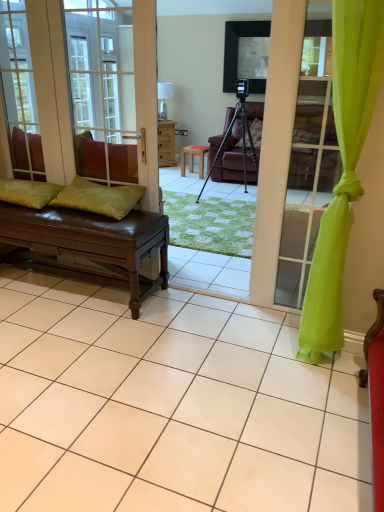
Where is `green fabric pillow at left, which is the 1th pillow in left-to-right order`? This screenshot has height=512, width=384. green fabric pillow at left, which is the 1th pillow in left-to-right order is located at coordinates (28, 192).

The image size is (384, 512). Describe the element at coordinates (193, 157) in the screenshot. I see `wooden stool at center` at that location.

You are a GUI agent. You are given a task and a screenshot of the screen. Output one action in this format:
    pyautogui.click(x=<x>, y=<y>)
    Task: Click on the lime green fabric at right
    This screenshot has width=384, height=512.
    Given the screenshot: What is the action you would take?
    pyautogui.click(x=343, y=168)

Describe the element at coordinates (19, 93) in the screenshot. This screenshot has height=512, width=384. I see `clear glass window at left` at that location.

You are a GUI agent. You are given a task and a screenshot of the screen. Output one action in this format:
    pyautogui.click(x=<x>, y=<y>)
    Task: Click on the brown leather bench at left
    
    Given the screenshot: What is the action you would take?
    pyautogui.click(x=86, y=226)

Which of these two, brown leather bench at left or brown leather bench at left, is bigger?

brown leather bench at left.

From the image's perspective, does brown leather bench at left appear higher than brown leather bench at left?

Yes, from the image's perspective, brown leather bench at left is on top of brown leather bench at left.

How many degrees apart are the facing directions of brown leather bench at left and brown leather bench at left?

brown leather bench at left and brown leather bench at left are facing 0.275 degrees away from each other.

From a real-world perspective, which is physically above, brown leather bench at left or brown leather bench at left?

brown leather bench at left.

Is clear glass window at left spatially inside brown leather bench at left, or outside of it?

clear glass window at left cannot be found inside brown leather bench at left.

How different are the orientations of clear glass window at left and brown leather bench at left in degrees?

0.0524 degrees separate the facing orientations of clear glass window at left and brown leather bench at left.

Based on the photo, is clear glass window at left looking in the opposite direction of brown leather bench at left?

That's not correct — clear glass window at left is not looking away from brown leather bench at left.

Which of these two, clear glass window at left or brown leather bench at left, is bigger?

Bigger between the two is brown leather bench at left.

Is point (113, 129) less distant than point (22, 199)?

No, it is not.

You are a GUI agent. You are given a task and a screenshot of the screen. Output one action in this format:
    pyautogui.click(x=<x>, y=<y>)
    Task: Click on the 2nd pillow to the left of the brown leather bench at left, counting from the anchor's position
    The width and height of the screenshot is (384, 512).
    Given the screenshot: What is the action you would take?
    pyautogui.click(x=28, y=192)

Are brown leather bench at left and green fabric pillow at left, which is the 1th pillow in left-to-right order, far apart?

brown leather bench at left is near green fabric pillow at left, which is the 1th pillow in left-to-right order, not far away.

Is brown leather bench at left behind green fabric pillow at left, which is the 1th pillow in left-to-right order?

No, brown leather bench at left is closer to the camera.

Is brown leather bench at left bigger than lime green fabric at right?

Yes.

The image size is (384, 512). I want to click on curtain to the right of brown leather bench at left, so click(x=343, y=168).

Consider the image. Is brown leather bench at left located outside lime green fabric at right?

Yes, brown leather bench at left is outside of lime green fabric at right.

Does point (156, 242) come behind point (324, 254)?

Yes, it is.

Find the location of `the 1st pillow in front of the matte black tripod at center, starting your count from the anchor`. the 1st pillow in front of the matte black tripod at center, starting your count from the anchor is located at coordinates (28, 192).

From a real-world perspective, is matte black tripod at center located higher than green fabric pillow at left, the second pillow in the right-to-left sequence?

No, from a real-world perspective, matte black tripod at center is not on top of green fabric pillow at left, the second pillow in the right-to-left sequence.

From the image's perspective, is matte black tripod at center beneath green fabric pillow at left, the second pillow in the right-to-left sequence?

Incorrect, from the image's perspective, matte black tripod at center is higher than green fabric pillow at left, the second pillow in the right-to-left sequence.

Is matte black tripod at center oriented towards green fabric pillow at left, which is the 1th pillow in left-to-right order?

Yes, matte black tripod at center is turned towards green fabric pillow at left, which is the 1th pillow in left-to-right order.

Does green leather pillow at left, which is counted as the 1th pillow, starting from the right, have a lesser width compared to lime green fabric at right?

Incorrect, the width of green leather pillow at left, which is counted as the 1th pillow, starting from the right, is not less than that of lime green fabric at right.

From the image's perspective, is green leather pillow at left, placed as the 2th pillow when sorted from left to right, above or below lime green fabric at right?

From the image's perspective, green leather pillow at left, placed as the 2th pillow when sorted from left to right, appears below lime green fabric at right.

Between green leather pillow at left, placed as the 2th pillow when sorted from left to right, and lime green fabric at right, which one has smaller size?

green leather pillow at left, placed as the 2th pillow when sorted from left to right, is smaller.

Is lime green fabric at right at the back of green leather pillow at left, which is counted as the 1th pillow, starting from the right?

No, green leather pillow at left, which is counted as the 1th pillow, starting from the right, is not facing the opposite direction of lime green fabric at right.

Is lime green fabric at right oriented away from brown leather bench at left?

No, lime green fabric at right's orientation is not away from brown leather bench at left.

Is point (369, 103) farther from camera compared to point (114, 170)?

No.

Can you confirm if lime green fabric at right is wider than brown leather bench at left?

Yes, lime green fabric at right is wider than brown leather bench at left.

Where is `screen door on the right of the brown leather bench at left`? screen door on the right of the brown leather bench at left is located at coordinates (103, 90).

There is a brown leather bench at left. Where is `window above it (from a real-world perspective)`? window above it (from a real-world perspective) is located at coordinates (19, 93).

Based on their spatial positions, is green fabric pillow at left, the second pillow in the right-to-left sequence, or lime green fabric at right further from wooden stool at center?

lime green fabric at right is positioned further to the anchor wooden stool at center.

From the image, which object appears to be nearer to green leather pillow at left, placed as the 2th pillow when sorted from left to right, green fabric pillow at left, which is the 1th pillow in left-to-right order, or brown leather bench at left?

The object closer to green leather pillow at left, placed as the 2th pillow when sorted from left to right, is brown leather bench at left.

Considering their positions, is green leather pillow at left, placed as the 2th pillow when sorted from left to right, positioned closer to lime green fabric at right than brown leather bench at left?

green leather pillow at left, placed as the 2th pillow when sorted from left to right.

Based on their spatial positions, is brown leather bench at left or lime green fabric at right closer to clear glass window at left?

The object closer to clear glass window at left is brown leather bench at left.

When comparing their distances from green fabric pillow at left, the second pillow in the right-to-left sequence, does brown leather bench at left or brown leather bench at left seem closer?

The object closer to green fabric pillow at left, the second pillow in the right-to-left sequence, is brown leather bench at left.

Based on their spatial positions, is green fabric pillow at left, the second pillow in the right-to-left sequence, or brown leather bench at left further from clear glass window at left?

brown leather bench at left is positioned further to the anchor clear glass window at left.

Estimate the real-world distances between objects in this image. Which object is closer to wooden stool at center, green leather pillow at left, which is counted as the 1th pillow, starting from the right, or clear glass window at left?

clear glass window at left is positioned closer to the anchor wooden stool at center.

Based on their spatial positions, is lime green fabric at right or brown leather bench at left further from clear glass window at left?

lime green fabric at right is positioned further to the anchor clear glass window at left.

Locate an element on the screen. pillow between clear glass window at left and matte black tripod at center along the z-axis is located at coordinates (28, 192).

Find the location of a particular element. The image size is (384, 512). screen door between brown leather bench at left and matte black tripod at center in the front-back direction is located at coordinates (103, 90).

The height and width of the screenshot is (512, 384). I want to click on tripod between green leather pillow at left, placed as the 2th pillow when sorted from left to right, and wooden stool at center, along the z-axis, so click(x=243, y=143).

You are a GUI agent. You are given a task and a screenshot of the screen. Output one action in this format:
    pyautogui.click(x=<x>, y=<y>)
    Task: Click on the studio couch located between green fabric pillow at left, the second pillow in the right-to-left sequence, and lime green fabric at right in the left-right direction
    
    Given the screenshot: What is the action you would take?
    pyautogui.click(x=86, y=226)